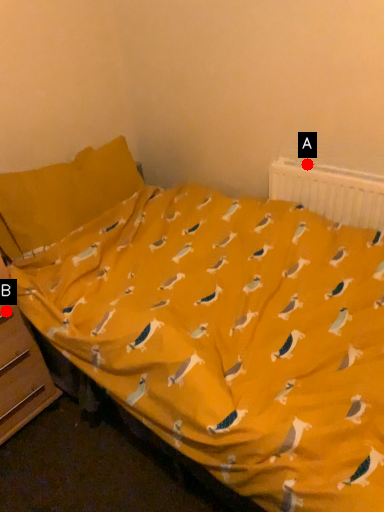
Question: Two points are circled on the image, labeled by A and B beside each circle. Which point is closer to the camera taking this photo?

Choices:
 (A) A is closer
 (B) B is closer

Answer: (B)